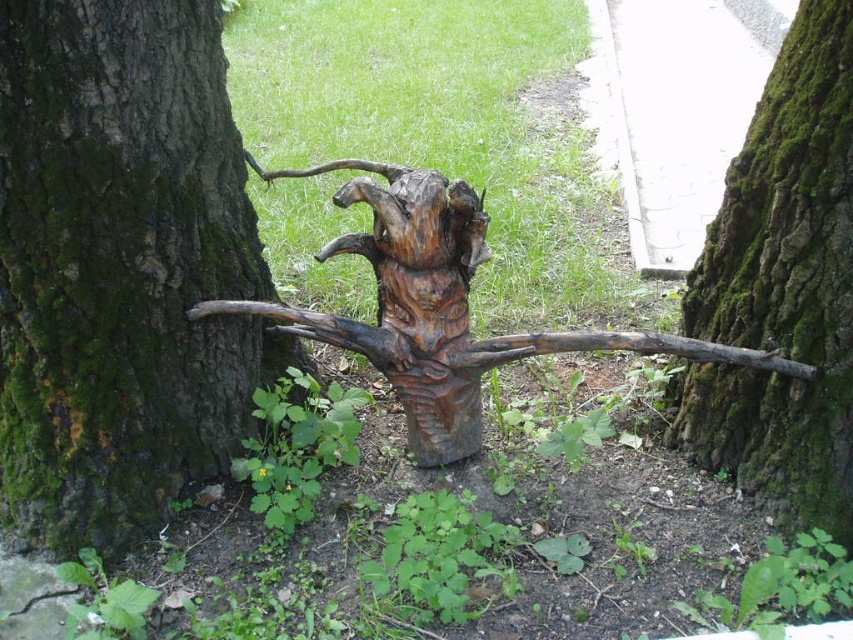
Question: Which point appears farthest from the camera in this image?

Choices:
 (A) click(451, 257)
 (B) click(175, 296)
 (C) click(831, 29)

Answer: (A)

Question: Does dark brown wood at center appear on the right side of green mossy bark at center?

Choices:
 (A) no
 (B) yes

Answer: (A)

Question: Is dark brown wood at center to the right of green mossy bark at center from the viewer's perspective?

Choices:
 (A) yes
 (B) no

Answer: (B)

Question: Does green mossy bark at center have a larger size compared to natural wood sculpture at center?

Choices:
 (A) yes
 (B) no

Answer: (B)

Question: Which object is farther from the camera taking this photo?

Choices:
 (A) dark brown wood at center
 (B) green mossy bark at center
 (C) natural wood sculpture at center

Answer: (C)

Question: Which object is the farthest from the green mossy bark at center?

Choices:
 (A) natural wood sculpture at center
 (B) dark brown wood at center

Answer: (B)